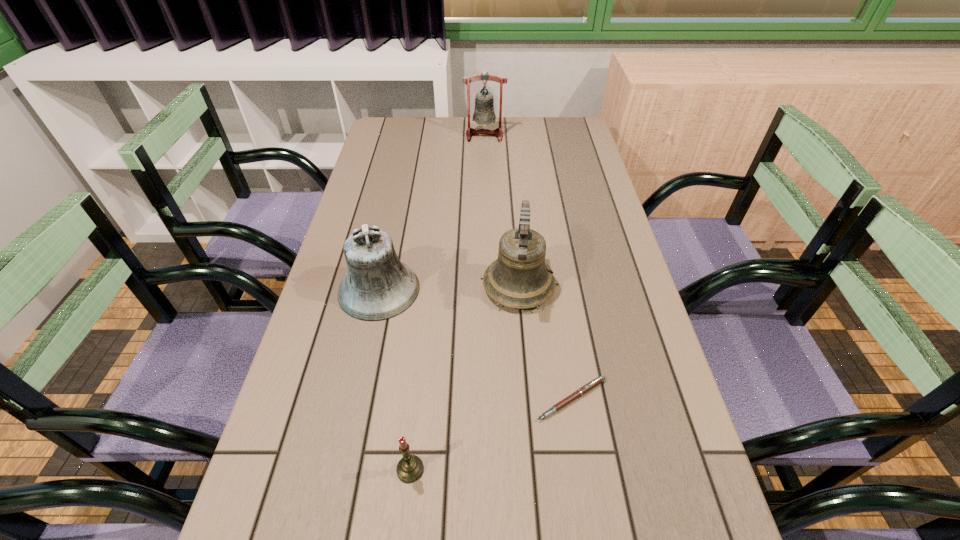
Where is `the farthest bell`? the farthest bell is located at coordinates (484, 113).

Image resolution: width=960 pixels, height=540 pixels. I want to click on the leftmost object, so click(378, 286).

You are a GUI agent. You are given a task and a screenshot of the screen. Output one action in this format:
    pyautogui.click(x=<x>, y=<y>)
    Task: Click on the nearest object
    The width and height of the screenshot is (960, 540).
    Given the screenshot: What is the action you would take?
    pyautogui.click(x=410, y=468)

The image size is (960, 540). I want to click on candle, so click(410, 468).

Identify the location of the shortest object. The image size is (960, 540). (592, 384).

You are a GUI agent. You are given a task and a screenshot of the screen. Output one action in this format:
    pyautogui.click(x=<x>, y=<y>)
    Task: Click on the pen
    The image size is (960, 540).
    Given the screenshot: What is the action you would take?
    pyautogui.click(x=592, y=384)

The width and height of the screenshot is (960, 540). I want to click on vacant area located 0.090m on the front of the farthest bell, so click(x=485, y=155).

Locate an element on the screen. Image resolution: width=960 pixels, height=540 pixels. vacant space situated 0.300m on the back of the leftmost bell is located at coordinates (399, 195).

You are a GUI agent. You are given a task and a screenshot of the screen. Output one action in this format:
    pyautogui.click(x=<x>, y=<y>)
    Task: Click on the vacant space located on the right of the second shortest object
    This screenshot has height=540, width=960.
    Given the screenshot: What is the action you would take?
    pyautogui.click(x=484, y=469)

Locate an element on the screen. Image resolution: width=960 pixels, height=540 pixels. free region located 0.150m at the nib of the pen is located at coordinates (588, 504).